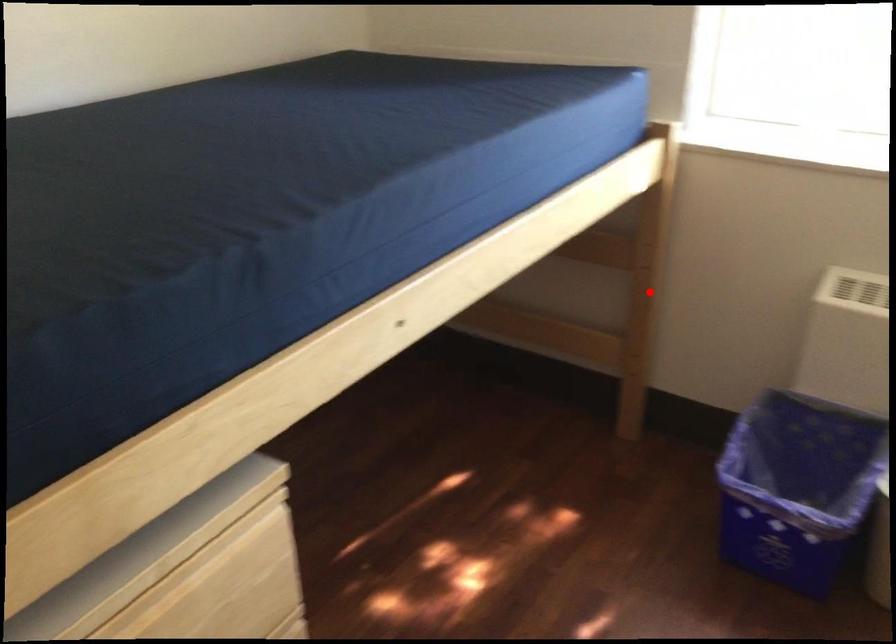
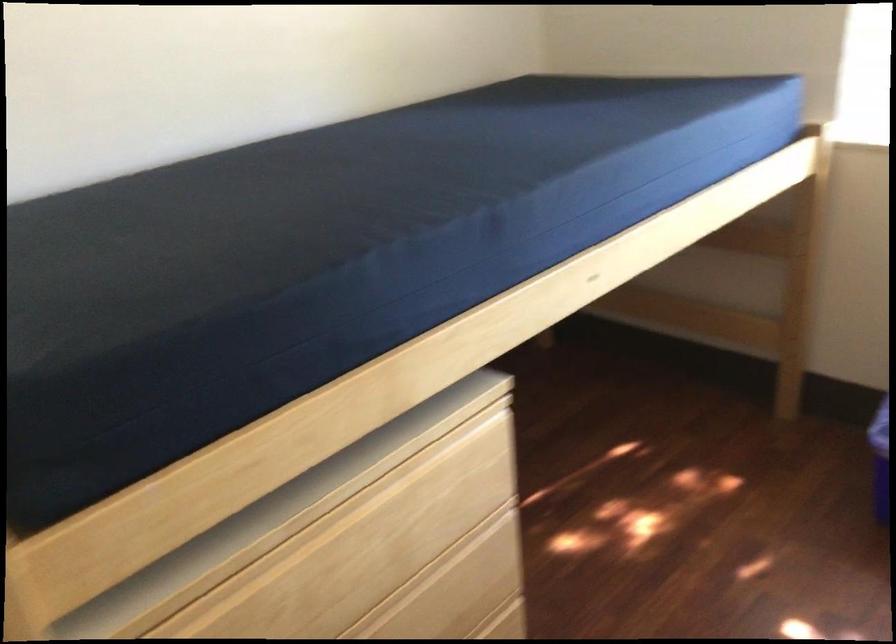
In the second image, find the point that corresponds to the highlighted location in the first image.

(803, 275)